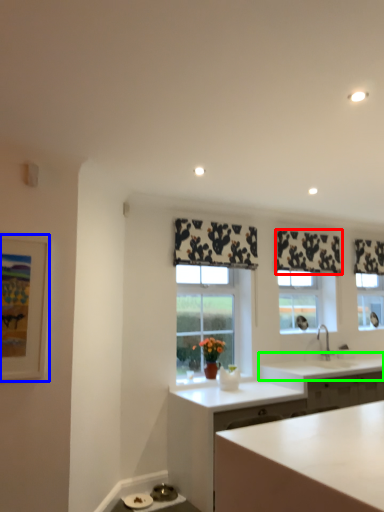
Question: Which object is the farthest from curtain (highlighted by a red box)? Choose among these: picture frame (highlighted by a blue box) or countertop (highlighted by a green box).

Choices:
 (A) picture frame
 (B) countertop

Answer: (A)